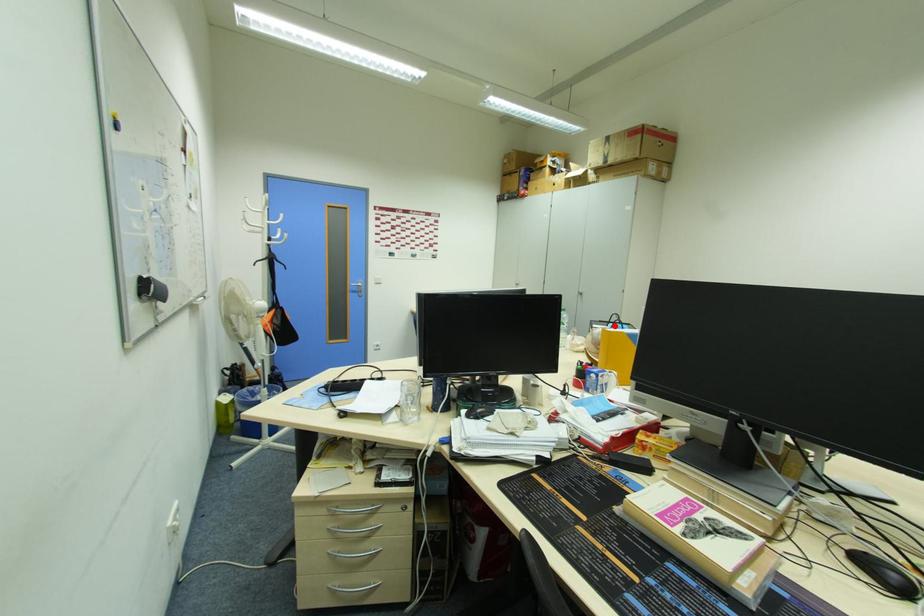
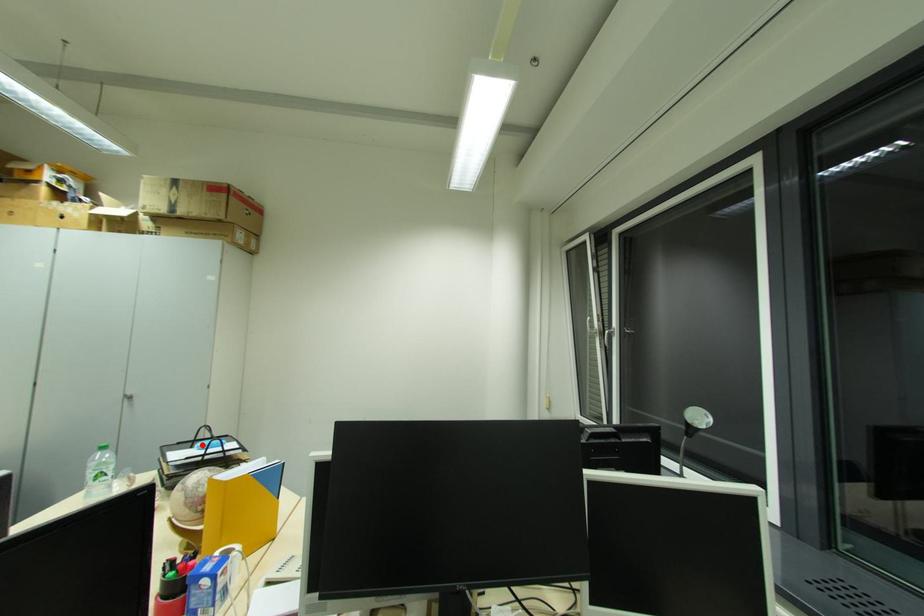
I am providing you with two images of the same scene from different viewpoints. A red point is marked on the first image and another point is marked on the second image. Is the marked point in image1 the same physical position as the marked point in image2?

Yes